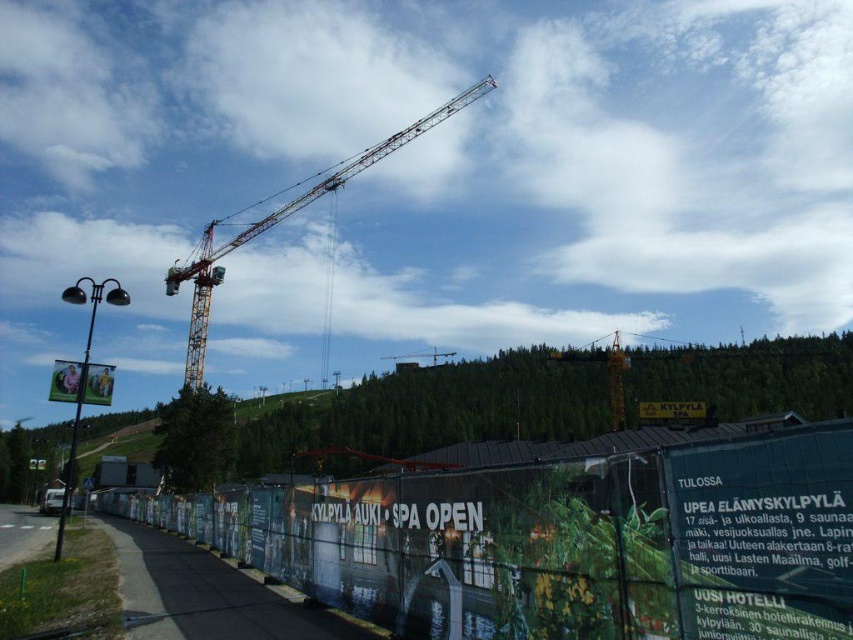
Question: Does green fabric fence at lower center appear under yellow metallic crane at upper center?

Choices:
 (A) no
 (B) yes

Answer: (B)

Question: Among these objects, which one is nearest to the camera?

Choices:
 (A) yellow metallic crane at center
 (B) red plastic sign at center
 (C) matte plastic sign at lower left
 (D) green fabric fence at lower center

Answer: (D)

Question: Considering the relative positions of green fabric fence at lower center and matte plastic sign at lower left in the image provided, where is green fabric fence at lower center located with respect to matte plastic sign at lower left?

Choices:
 (A) left
 (B) right

Answer: (B)

Question: Which point is closer to the camera?

Choices:
 (A) (430, 355)
 (B) (88, 364)
 (C) (434, 605)
 (D) (196, 328)

Answer: (C)

Question: Among these points, which one is nearest to the camera?

Choices:
 (A) (199, 298)
 (B) (416, 365)
 (C) (672, 410)

Answer: (C)

Question: Is red plastic sign at center thinner than yellow metallic crane at center?

Choices:
 (A) yes
 (B) no

Answer: (B)